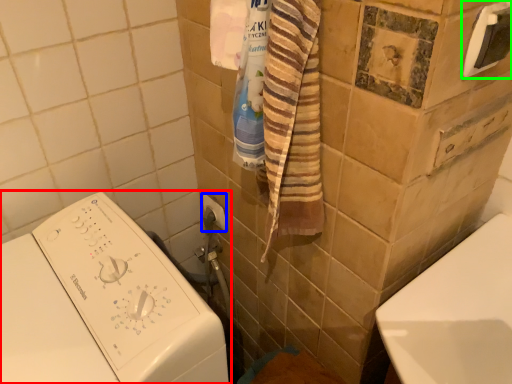
Question: Which is nearer to the washing machine (highlighted by a red box)? towel bar (highlighted by a blue box) or towel bar (highlighted by a green box).

Choices:
 (A) towel bar
 (B) towel bar

Answer: (A)